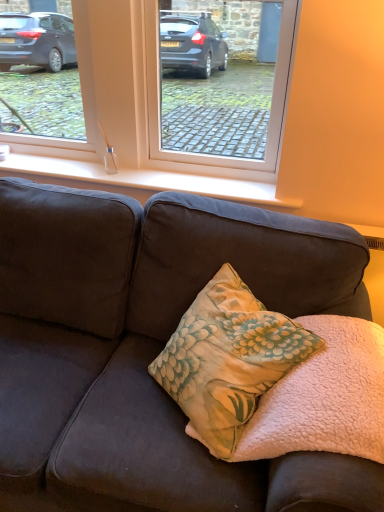
Question: Is the position of fluffy pink blanket at center more distant than that of matte glass window at upper center?

Choices:
 (A) no
 (B) yes

Answer: (A)

Question: From the image's perspective, is fluffy pink blanket at center over matte glass window at upper center?

Choices:
 (A) yes
 (B) no

Answer: (B)

Question: From the image's perspective, is fluffy pink blanket at center beneath matte glass window at upper center?

Choices:
 (A) yes
 (B) no

Answer: (A)

Question: Is fluffy pink blanket at center not close to matte glass window at upper center?

Choices:
 (A) no
 (B) yes

Answer: (A)

Question: Can you confirm if fluffy pink blanket at center is positioned to the left of matte glass window at upper center?

Choices:
 (A) yes
 (B) no

Answer: (B)

Question: From their relative heights in the image, would you say floral fabric pillow at center is taller or shorter than white glossy glass at center?

Choices:
 (A) short
 (B) tall

Answer: (B)

Question: From a real-world perspective, is floral fabric pillow at center positioned above or below white glossy glass at center?

Choices:
 (A) below
 (B) above

Answer: (A)

Question: Considering the positions of floral fabric pillow at center and white glossy glass at center in the image, is floral fabric pillow at center bigger or smaller than white glossy glass at center?

Choices:
 (A) big
 (B) small

Answer: (A)

Question: Is floral fabric pillow at center inside the boundaries of white glossy glass at center, or outside?

Choices:
 (A) inside
 (B) outside

Answer: (B)

Question: From the image's perspective, is white glossy glass at center above or below fluffy pink blanket at center?

Choices:
 (A) above
 (B) below

Answer: (A)

Question: In terms of width, does white glossy glass at center look wider or thinner when compared to fluffy pink blanket at center?

Choices:
 (A) thin
 (B) wide

Answer: (A)

Question: Choose the correct answer: Is white glossy glass at center inside fluffy pink blanket at center or outside it?

Choices:
 (A) inside
 (B) outside

Answer: (B)

Question: Considering the relative positions of white glossy glass at center and fluffy pink blanket at center in the image provided, is white glossy glass at center to the left or to the right of fluffy pink blanket at center?

Choices:
 (A) right
 (B) left

Answer: (B)

Question: Looking at their shapes, would you say floral fabric pillow at center is wider or thinner than matte glass window at upper center?

Choices:
 (A) thin
 (B) wide

Answer: (B)

Question: Which is correct: floral fabric pillow at center is inside matte glass window at upper center, or outside of it?

Choices:
 (A) outside
 (B) inside

Answer: (A)